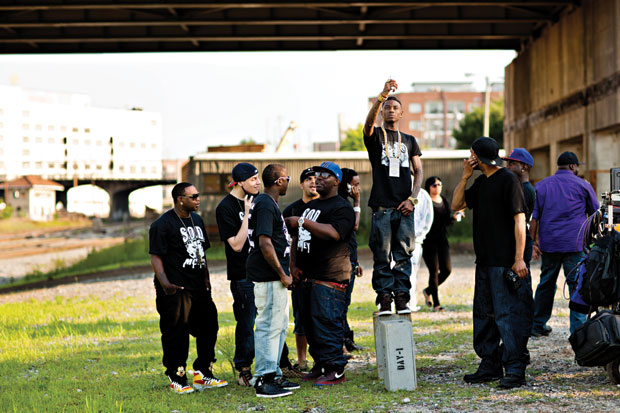
The height and width of the screenshot is (413, 620). I want to click on wall, so click(x=140, y=131).